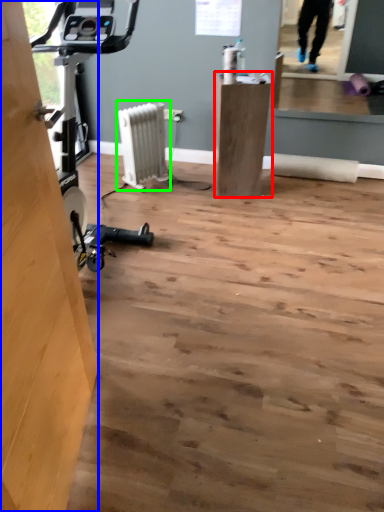
Question: Based on their relative distances, which object is farther from furniture (highlighted by a red box)? Choose from plywood (highlighted by a blue box) and radiator (highlighted by a green box).

Choices:
 (A) plywood
 (B) radiator

Answer: (A)